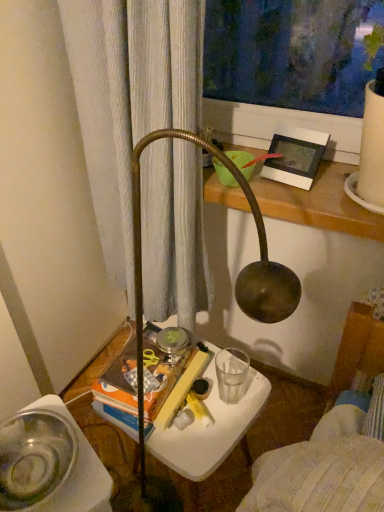
The height and width of the screenshot is (512, 384). I want to click on white plastic picture frame at upper right, so click(295, 156).

Image resolution: width=384 pixels, height=512 pixels. Describe the element at coordinates (34, 457) in the screenshot. I see `metallic silver bowl at lower left` at that location.

I want to click on white plastic picture frame at upper right, so click(295, 156).

Looking at their sizes, would you say white plastic table at center is wider or thinner than clear glass water at lower center?

In the image, white plastic table at center appears to be wider than clear glass water at lower center.

Is white plastic table at center taller than clear glass water at lower center?

Correct, white plastic table at center is much taller as clear glass water at lower center.

From a real-world perspective, is white plastic table at center physically above clear glass water at lower center?

→ No.

Is white plastic table at center oriented towards clear glass water at lower center?

No, white plastic table at center is not facing towards clear glass water at lower center.

At what (x,y) coordinates should I click in order to perform the action: click on beverage located underneath the metallic silver bowl at lower left (from a real-world perspective). Please return your answer as a coordinate pair (x, y). Looking at the image, I should click on (231, 374).

Can you confirm if metallic silver bowl at lower left is positioned to the left of clear glass water at lower center?

Yes, metallic silver bowl at lower left is to the left of clear glass water at lower center.

From a real-world perspective, is metallic silver bowl at lower left located beneath clear glass water at lower center?

No, from a real-world perspective, metallic silver bowl at lower left is not beneath clear glass water at lower center.

Which is in front, clear glass water at lower center or metallic silver bowl at lower left?

metallic silver bowl at lower left is closer to the camera.

Can you confirm if clear glass water at lower center is thinner than metallic silver bowl at lower left?

Indeed, clear glass water at lower center has a lesser width compared to metallic silver bowl at lower left.

Is point (231, 398) behind point (7, 450)?

Yes, it is.

Are clear glass water at lower center and metallic silver bowl at lower left making contact?

There is a gap between clear glass water at lower center and metallic silver bowl at lower left.

From the image's perspective, is white plastic table at center beneath white plastic picture frame at upper right?

Yes, from the image's perspective, white plastic table at center is below white plastic picture frame at upper right.

Does point (77, 389) come farther from viewer compared to point (317, 157)?

Yes, point (77, 389) is behind point (317, 157).

What's the angular difference between white plastic table at center and white plastic picture frame at upper right's facing directions?

white plastic table at center and white plastic picture frame at upper right are facing 90.2 degrees away from each other.

Does white plastic table at center have a lesser height compared to white plastic picture frame at upper right?

Incorrect, the height of white plastic table at center does not fall short of that of white plastic picture frame at upper right.

This screenshot has height=512, width=384. Identify the location of picture frame above the metallic silver bowl at lower left (from a real-world perspective). (295, 156).

From the picture: From the image's perspective, is metallic silver bowl at lower left under white plastic picture frame at upper right?

Yes.

In terms of width, does metallic silver bowl at lower left look wider or thinner when compared to white plastic picture frame at upper right?

Clearly, metallic silver bowl at lower left has more width compared to white plastic picture frame at upper right.

I want to click on glass bowl located above the white plastic table at center (from the image's perspective), so click(34, 457).

Which object is closer to the camera, metallic silver bowl at lower left or white plastic table at center?

Positioned in front is metallic silver bowl at lower left.

Between metallic silver bowl at lower left and white plastic table at center, which one has less height?

metallic silver bowl at lower left is shorter.

Can white plastic table at center be found inside metallic silver bowl at lower left?

No, white plastic table at center is located outside of metallic silver bowl at lower left.

Is white plastic table at center to the right of metallic silver bowl at lower left from the viewer's perspective?

Yes.

From a real-world perspective, is white plastic table at center above or below metallic silver bowl at lower left?

white plastic table at center is below metallic silver bowl at lower left.

Between white plastic table at center and metallic silver bowl at lower left, which one has smaller size?

Smaller between the two is metallic silver bowl at lower left.

Who is shorter, white plastic table at center or metallic silver bowl at lower left?

Standing shorter between the two is metallic silver bowl at lower left.

I want to click on beverage that appears above the white plastic table at center (from a real-world perspective), so click(231, 374).

Where is `beverage lying above the metallic silver bowl at lower left (from the image's perspective)`? beverage lying above the metallic silver bowl at lower left (from the image's perspective) is located at coordinates (231, 374).

Which object lies further to the anchor point white plastic picture frame at upper right, white plastic table at center or clear glass water at lower center?

white plastic table at center is further to white plastic picture frame at upper right.

Based on their spatial positions, is white plastic table at center or white plastic picture frame at upper right closer to metallic silver bowl at lower left?

white plastic table at center.

From the image, which object appears to be nearer to clear glass water at lower center, white plastic picture frame at upper right or metallic silver bowl at lower left?

metallic silver bowl at lower left.

From the image, which object appears to be nearer to metallic silver bowl at lower left, white plastic picture frame at upper right or clear glass water at lower center?

clear glass water at lower center is closer to metallic silver bowl at lower left.

From the image, which object appears to be farther from metallic silver bowl at lower left, white plastic picture frame at upper right or white plastic table at center?

white plastic picture frame at upper right lies further to metallic silver bowl at lower left than the other object.

When comparing their distances from white plastic picture frame at upper right, does metallic silver bowl at lower left or white plastic table at center seem further?

metallic silver bowl at lower left.

Estimate the real-world distances between objects in this image. Which object is further from metallic silver bowl at lower left, clear glass water at lower center or white plastic table at center?

clear glass water at lower center is positioned further to the anchor metallic silver bowl at lower left.

Based on their spatial positions, is metallic silver bowl at lower left or clear glass water at lower center further from white plastic picture frame at upper right?

metallic silver bowl at lower left is positioned further to the anchor white plastic picture frame at upper right.

Locate an element on the screen. This screenshot has width=384, height=512. beverage that lies between white plastic picture frame at upper right and metallic silver bowl at lower left from top to bottom is located at coordinates (231, 374).

This screenshot has width=384, height=512. Identify the location of beverage between white plastic picture frame at upper right and white plastic table at center in the vertical direction. (231, 374).

Identify the location of table situated between metallic silver bowl at lower left and clear glass water at lower center from left to right. (207, 443).

The image size is (384, 512). I want to click on glass bowl that lies between white plastic picture frame at upper right and white plastic table at center from top to bottom, so click(34, 457).